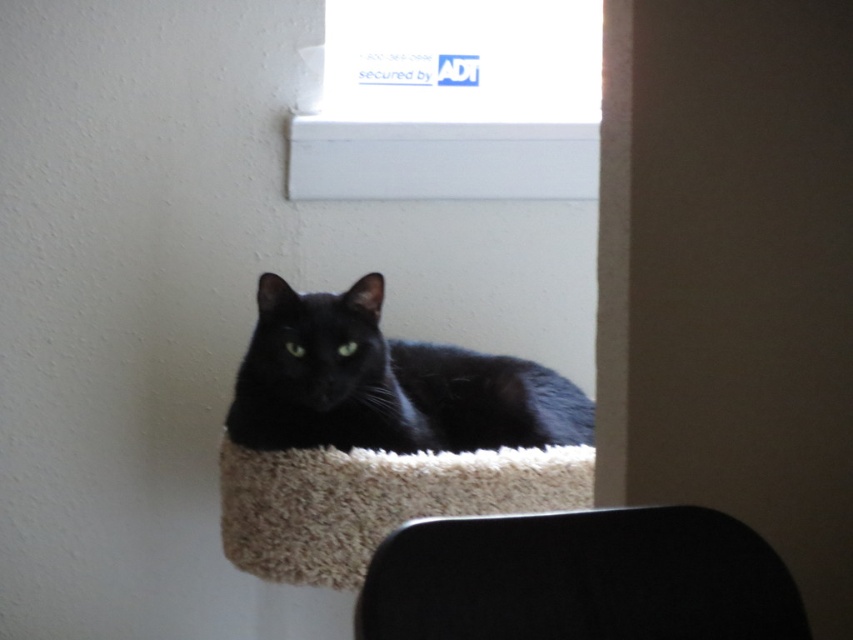
Question: From the image, what is the correct spatial relationship of matte black cat at center in relation to beige fluffy cat bed at center?

Choices:
 (A) above
 (B) below

Answer: (A)

Question: Which object appears farthest from the camera in this image?

Choices:
 (A) beige fluffy cat bed at center
 (B) matte black cat at center
 (C) white smooth window sill at upper center

Answer: (C)

Question: Does white plastic window sill at upper center have a lesser width compared to white smooth window sill at upper center?

Choices:
 (A) no
 (B) yes

Answer: (A)

Question: Which object appears farthest from the camera in this image?

Choices:
 (A) beige fluffy cat bed at center
 (B) white plastic window sill at upper center
 (C) smooth black chair at lower center
 (D) white smooth window sill at upper center

Answer: (D)

Question: Where is white plastic window sill at upper center located in relation to matte black cat at center in the image?

Choices:
 (A) right
 (B) left

Answer: (A)

Question: Which of the following is the farthest from the observer?

Choices:
 (A) (485, 474)
 (B) (289, 372)
 (C) (367, 24)

Answer: (C)